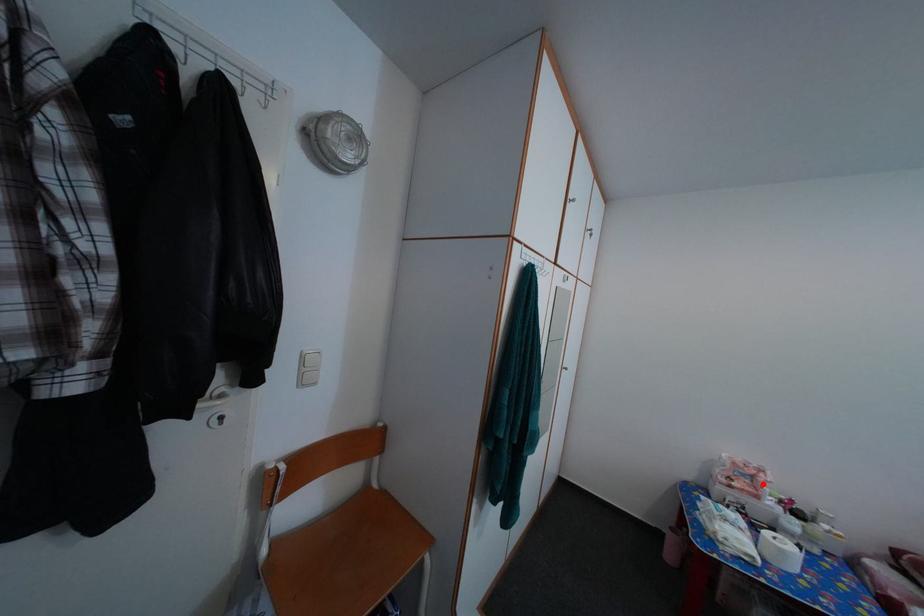
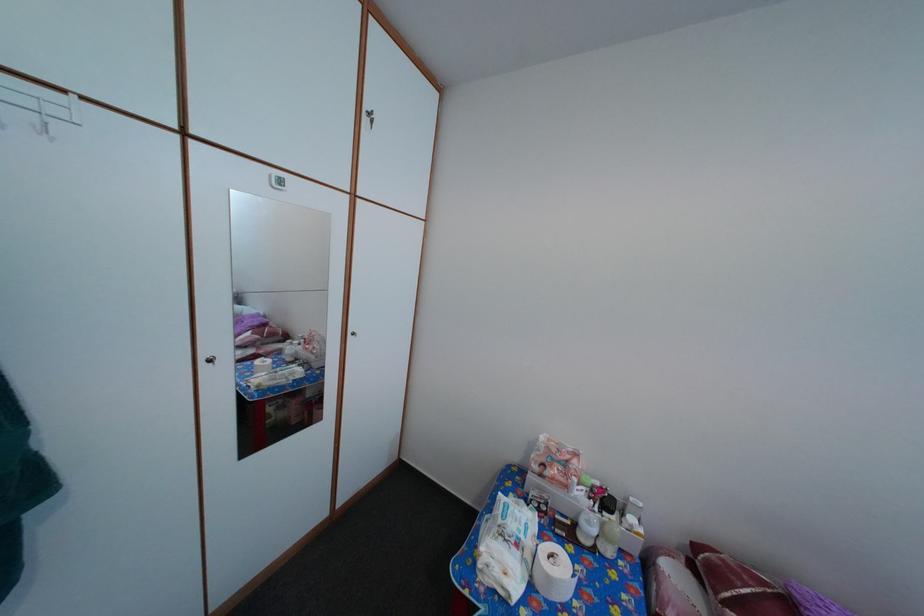
Question: A red point is marked in image1. In image2, is the corresponding 3D point closer to the camera or farther? Reply with the corresponding letter.

Choices:
 (A) The corresponding 3D point is closer.
 (B) The corresponding 3D point is farther.

Answer: (B)